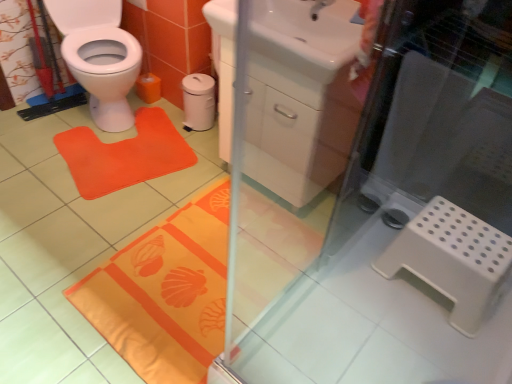
Question: Does matte white tap at upper center lie in front of white plastic step stool at lower right?

Choices:
 (A) no
 (B) yes

Answer: (A)

Question: Is matte white tap at upper center wider than white plastic step stool at lower right?

Choices:
 (A) yes
 (B) no

Answer: (B)

Question: Does matte white tap at upper center come behind white plastic step stool at lower right?

Choices:
 (A) no
 (B) yes

Answer: (B)

Question: Is matte white tap at upper center turned away from white plastic step stool at lower right?

Choices:
 (A) yes
 (B) no

Answer: (B)

Question: From a real-world perspective, is matte white tap at upper center over white plastic step stool at lower right?

Choices:
 (A) no
 (B) yes

Answer: (B)

Question: In terms of height, does white plastic step stool at lower right look taller or shorter compared to matte white tap at upper center?

Choices:
 (A) tall
 (B) short

Answer: (A)

Question: Is point (439, 264) closer or farther from the camera than point (315, 19)?

Choices:
 (A) closer
 (B) farther

Answer: (A)

Question: From a real-world perspective, relative to matte white tap at upper center, is white plastic step stool at lower right vertically above or below?

Choices:
 (A) below
 (B) above

Answer: (A)

Question: From the image's perspective, is white plastic step stool at lower right above or below matte white tap at upper center?

Choices:
 (A) above
 (B) below

Answer: (B)

Question: Is orange fabric mat at left taller or shorter than matte white tap at upper center?

Choices:
 (A) tall
 (B) short

Answer: (B)

Question: From the image's perspective, is orange fabric mat at left above or below matte white tap at upper center?

Choices:
 (A) below
 (B) above

Answer: (A)

Question: In terms of size, does orange fabric mat at left appear bigger or smaller than matte white tap at upper center?

Choices:
 (A) small
 (B) big

Answer: (B)

Question: From a real-world perspective, is orange fabric mat at left positioned above or below matte white tap at upper center?

Choices:
 (A) above
 (B) below

Answer: (B)

Question: Is white matte trash can at center inside or outside of white plastic step stool at lower right?

Choices:
 (A) outside
 (B) inside

Answer: (A)

Question: Is white matte trash can at center taller or shorter than white plastic step stool at lower right?

Choices:
 (A) short
 (B) tall

Answer: (B)